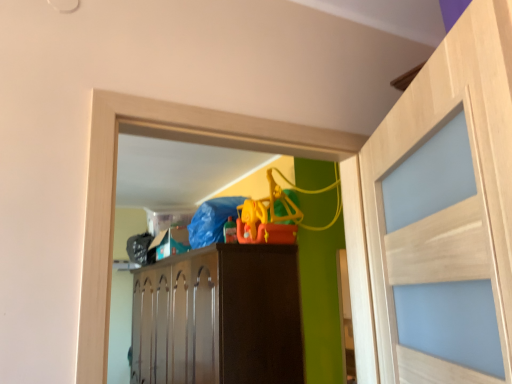
Describe the element at coordinates (221, 317) in the screenshot. I see `brown wood cabinet at center` at that location.

Identify the location of brown wood cabinet at center. (221, 317).

Find the location of `light wood door at right`. light wood door at right is located at coordinates (446, 211).

Image resolution: width=512 pixels, height=384 pixels. What do you see at coordinates (446, 211) in the screenshot? I see `light wood door at right` at bounding box center [446, 211].

Where is `brown wood cabinet at center`? brown wood cabinet at center is located at coordinates click(221, 317).

Is brown wood cabinet at center to the left or to the right of light wood door at right in the image?

brown wood cabinet at center is to the left of light wood door at right.

Between brown wood cabinet at center and light wood door at right, which one is positioned behind?

brown wood cabinet at center is further away from the camera.

Which is behind, point (191, 301) or point (395, 143)?

The point (191, 301) is farther.

From the image's perspective, relative to light wood door at right, is brown wood cabinet at center above or below?

Clearly, from the image's perspective, brown wood cabinet at center is below light wood door at right.

From a real-world perspective, is brown wood cabinet at center below light wood door at right?

Indeed, from a real-world perspective, brown wood cabinet at center is positioned beneath light wood door at right.

Which object is wider, brown wood cabinet at center or light wood door at right?

Wider between the two is brown wood cabinet at center.

From their relative heights in the image, would you say brown wood cabinet at center is taller or shorter than light wood door at right?

In the image, brown wood cabinet at center appears to be taller than light wood door at right.

Considering the relative sizes of brown wood cabinet at center and light wood door at right in the image provided, is brown wood cabinet at center bigger than light wood door at right?

Indeed, brown wood cabinet at center has a larger size compared to light wood door at right.

Is brown wood cabinet at center not inside light wood door at right?

Absolutely, brown wood cabinet at center is external to light wood door at right.

Are brown wood cabinet at center and light wood door at right beside each other?

No, brown wood cabinet at center is not next to light wood door at right.

From the picture: Is brown wood cabinet at center turned away from light wood door at right?

No, brown wood cabinet at center is not facing away from light wood door at right.

Measure the distance between brown wood cabinet at center and light wood door at right.

The distance of brown wood cabinet at center from light wood door at right is 1.76 meters.

Locate an element on the screen. Image resolution: width=512 pixels, height=384 pixels. door lying in front of the brown wood cabinet at center is located at coordinates (446, 211).

Does light wood door at right appear on the left side of brown wood cabinet at center?

No.

Considering the relative positions of light wood door at right and brown wood cabinet at center in the image provided, is light wood door at right in front of brown wood cabinet at center?

Yes, light wood door at right is in front of brown wood cabinet at center.

Considering the positions of points (505, 265) and (192, 358), is point (505, 265) closer to camera compared to point (192, 358)?

That is True.

From the image's perspective, is light wood door at right below brown wood cabinet at center?

No.

From a real-world perspective, between light wood door at right and brown wood cabinet at center, who is vertically higher?

light wood door at right is physically above.

Considering the sizes of objects light wood door at right and brown wood cabinet at center in the image provided, who is thinner, light wood door at right or brown wood cabinet at center?

light wood door at right.

Is light wood door at right taller than brown wood cabinet at center?

No, light wood door at right is not taller than brown wood cabinet at center.

Considering the relative sizes of light wood door at right and brown wood cabinet at center in the image provided, is light wood door at right bigger than brown wood cabinet at center?

No, light wood door at right is not bigger than brown wood cabinet at center.

Would you say light wood door at right is inside or outside brown wood cabinet at center?

The correct answer is: outside.

Is there a large distance between light wood door at right and brown wood cabinet at center?

Absolutely, light wood door at right is distant from brown wood cabinet at center.

Could you tell me if light wood door at right is facing brown wood cabinet at center?

No, light wood door at right is not facing towards brown wood cabinet at center.

Measure the distance between light wood door at right and brown wood cabinet at center.

A distance of 5.77 feet exists between light wood door at right and brown wood cabinet at center.

Find the location of a particular element. The width and height of the screenshot is (512, 384). door on the right side of brown wood cabinet at center is located at coordinates (446, 211).

Locate an element on the screen. The height and width of the screenshot is (384, 512). cabinetry below the light wood door at right (from the image's perspective) is located at coordinates (221, 317).

I want to click on door lying on the right of brown wood cabinet at center, so click(446, 211).